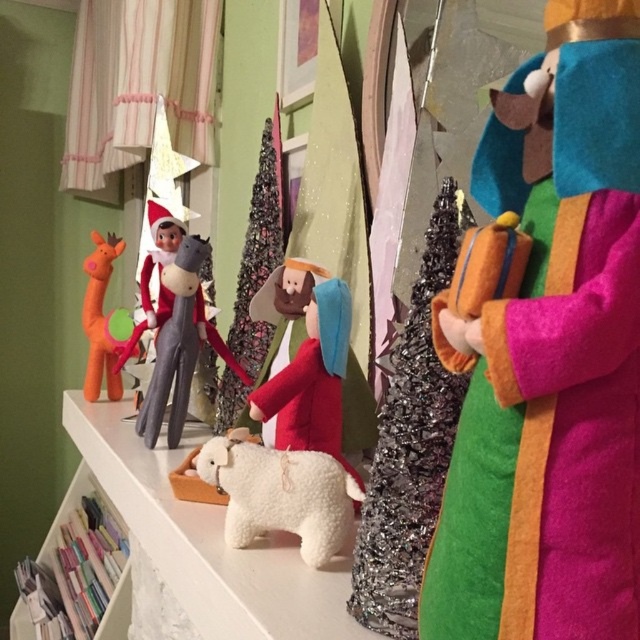
Does white plush bear at center have a lesser width compared to velvety gray horse at center?

No.

Does white plush bear at center have a greater height compared to velvety gray horse at center?

Incorrect, white plush bear at center's height is not larger of velvety gray horse at center's.

Which is behind, point (205, 458) or point (163, 362)?

Positioned behind is point (163, 362).

This screenshot has width=640, height=640. In order to click on white plush bear at center in this screenshot , I will do `click(280, 493)`.

Can you confirm if velvet green robe at center is thinner than velvety gray horse at center?

Indeed, velvet green robe at center has a lesser width compared to velvety gray horse at center.

Can you confirm if velvet green robe at center is bigger than velvety gray horse at center?

No, velvet green robe at center is not bigger than velvety gray horse at center.

At what (x,y) coordinates should I click in order to perform the action: click on velvet green robe at center. Please return your answer as a coordinate pair (x, y). The image size is (640, 640). Looking at the image, I should click on [547, 352].

Which of these two, velvet green robe at center or white plush bear at center, stands shorter?

white plush bear at center is shorter.

Is point (579, 131) positioned after point (332, 474)?

No, (579, 131) is in front of (332, 474).

Find the location of a particular element. This screenshot has height=640, width=640. velvet green robe at center is located at coordinates (547, 352).